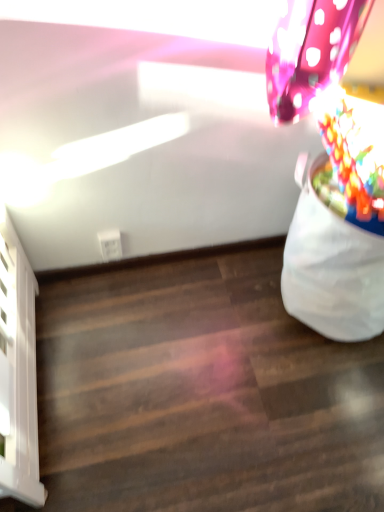
Locate an element on the screen. This screenshot has width=384, height=512. free space to the left of white fabric bean bag at right is located at coordinates (216, 326).